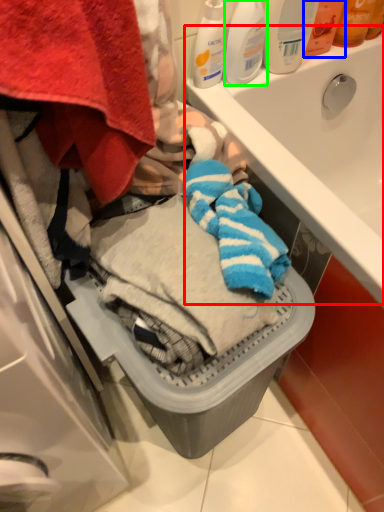
Question: Considering the real-world distances, which object is closest to sink (highlighted by a red box)? toiletry (highlighted by a blue box) or cleaning product (highlighted by a green box).

Choices:
 (A) toiletry
 (B) cleaning product

Answer: (A)